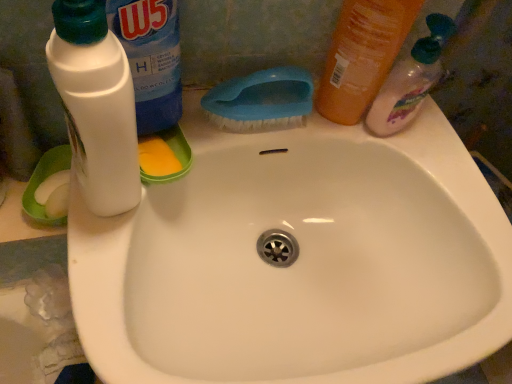
You are a GUI agent. You are given a task and a screenshot of the screen. Output one action in this format:
    pyautogui.click(x=<x>, y=<y>)
    Task: Click on the vacant space to the right of translucent plastic bottle at upper right, the 2th cleaning product from the left
    The image size is (512, 384).
    Given the screenshot: What is the action you would take?
    pyautogui.click(x=436, y=163)